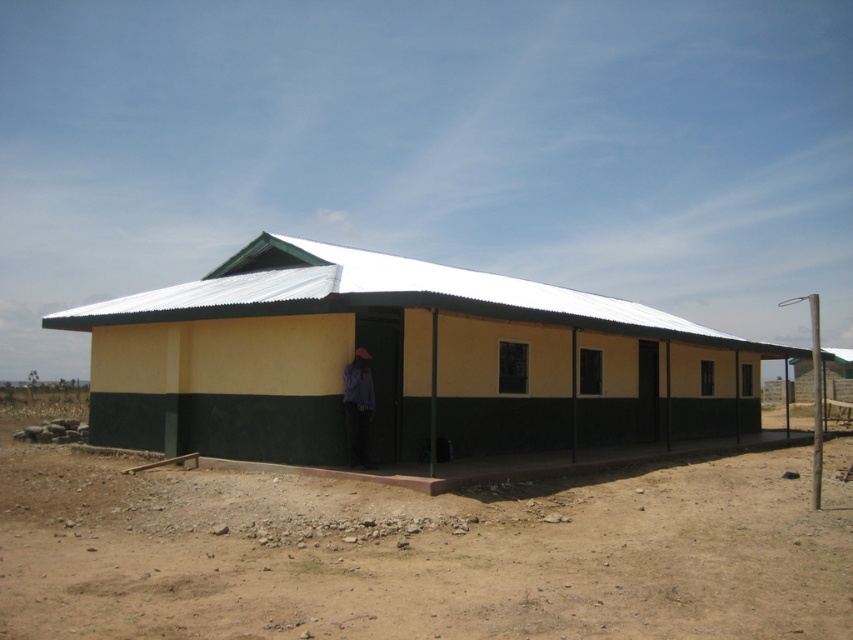
You are standing at the entrance of the building and want to place a small potted plant exactly at the position of the brown sandy dirt at lower center. What are the coordinates where you should place the plant?

The coordinates for the brown sandy dirt at lower center are at point (422, 552), so you should place the plant there.

You are standing in front of the building and want to walk from the entrance to the point closest to you. Which point should you go to, point (7, 604) or point (515, 355)?

You should go to point (7, 604) because it is closer to the viewer than point (515, 355).